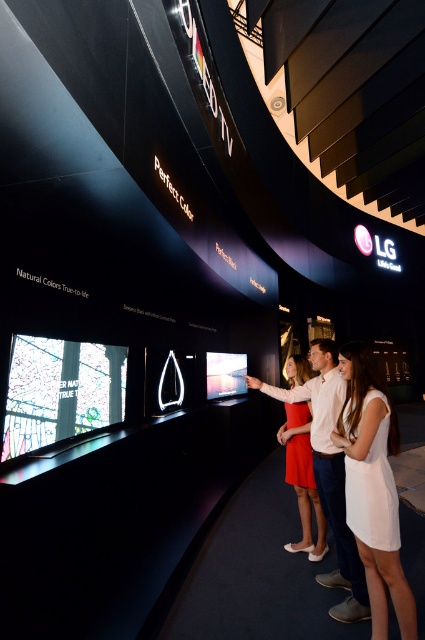
Which is more to the right, white cotton dress at center or white cotton shirt at center?

Positioned to the right is white cotton dress at center.

Is white cotton dress at center to the right of white cotton shirt at center from the viewer's perspective?

Yes, white cotton dress at center is to the right of white cotton shirt at center.

Image resolution: width=425 pixels, height=640 pixels. Describe the element at coordinates (373, 486) in the screenshot. I see `white cotton dress at center` at that location.

Find the location of a particular element. The image size is (425, 640). white cotton dress at center is located at coordinates (373, 486).

Does matte red dress at center appear on the left side of matte black video game at center?

In fact, matte red dress at center is to the right of matte black video game at center.

Between point (317, 531) and point (240, 387), which one is positioned behind?

Point (240, 387)

The width and height of the screenshot is (425, 640). Describe the element at coordinates (303, 477) in the screenshot. I see `matte red dress at center` at that location.

Where is `matte red dress at center`? This screenshot has width=425, height=640. matte red dress at center is located at coordinates (303, 477).

Between white cotton shirt at center and matte red dress at center, which one appears on the right side from the viewer's perspective?

white cotton shirt at center is more to the right.

Can you confirm if white cotton shirt at center is positioned to the left of matte red dress at center?

Incorrect, white cotton shirt at center is not on the left side of matte red dress at center.

Is point (314, 424) positioned in front of point (299, 472)?

Yes.

At what (x,y) coordinates should I click in order to perform the action: click on white cotton shirt at center. Please return your answer as a coordinate pair (x, y). Looking at the image, I should click on (331, 476).